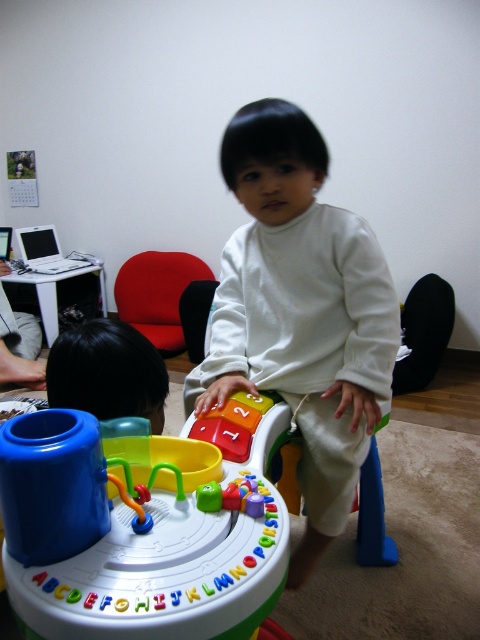
Question: Can you confirm if white matte toddler at center is wider than rubberized plastic number blocks at center?

Choices:
 (A) no
 (B) yes

Answer: (B)

Question: Which point is closer to the camera?

Choices:
 (A) white plastic walker at center
 (B) red fabric chair at center
 (C) white matte toddler at center
 (D) black hair at upper left

Answer: (A)

Question: Based on their relative distances, which object is nearer to the black hair at upper left?

Choices:
 (A) rubberized plastic number blocks at center
 (B) red fabric chair at center
 (C) white plastic walker at center

Answer: (A)

Question: Does white matte toddler at center have a smaller size compared to red fabric chair at center?

Choices:
 (A) no
 (B) yes

Answer: (B)

Question: Does white plastic walker at center appear over black hair at upper left?

Choices:
 (A) yes
 (B) no

Answer: (B)

Question: Which of the following is the closest to the observer?

Choices:
 (A) red fabric chair at center
 (B) rubberized plastic number blocks at center
 (C) white plastic walker at center

Answer: (C)